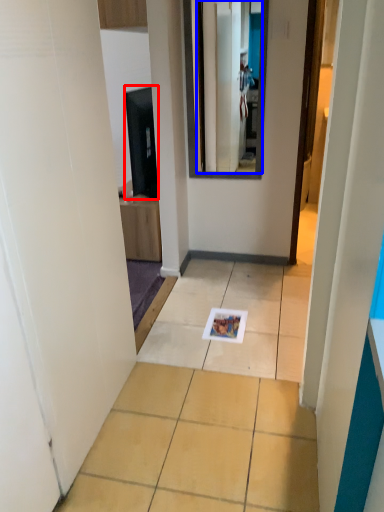
Question: Which object is closer to the camera taking this photo, appliance (highlighted by a red box) or mirror (highlighted by a blue box)?

Choices:
 (A) appliance
 (B) mirror

Answer: (B)